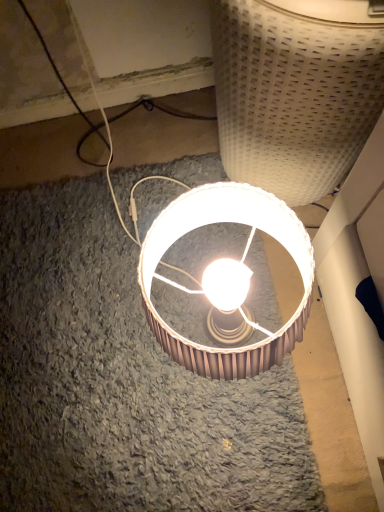
Question: Should I look upward or downward to see white woven basket at upper right?

Choices:
 (A) up
 (B) down

Answer: (A)